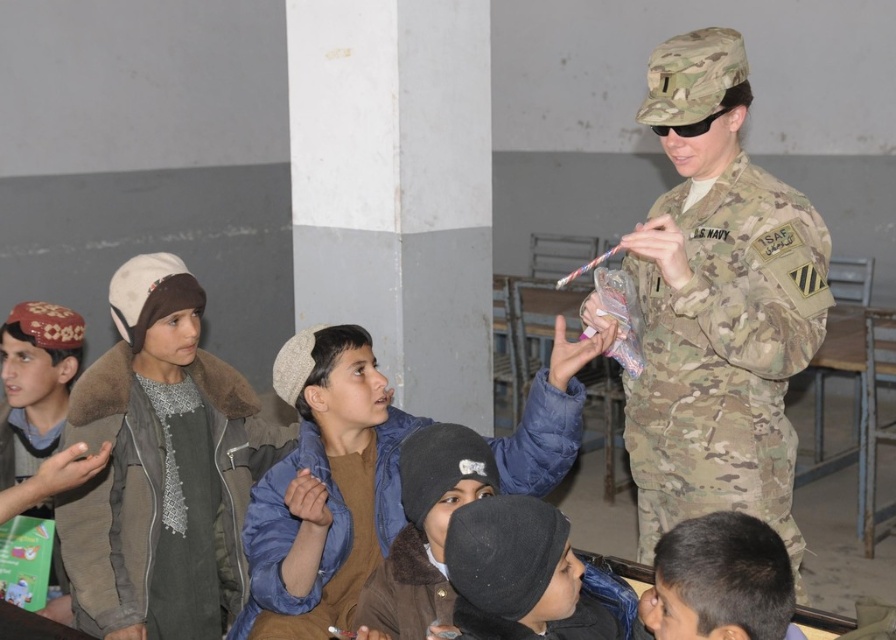
Who is positioned more to the right, camouflage uniform at right or brown fur-lined jacket at left?

From the viewer's perspective, camouflage uniform at right appears more on the right side.

Between camouflage uniform at right and brown fur-lined jacket at left, which one appears on the left side from the viewer's perspective?

From the viewer's perspective, brown fur-lined jacket at left appears more on the left side.

Is point (761, 252) in front of point (179, 538)?

That is True.

Locate an element on the screen. camouflage uniform at right is located at coordinates (718, 305).

Between brown fur-lined jacket at left and black woolen hat at lower center, which one is positioned lower?

black woolen hat at lower center

Between brown fur-lined jacket at left and black woolen hat at lower center, which one appears on the right side from the viewer's perspective?

From the viewer's perspective, black woolen hat at lower center appears more on the right side.

Does point (148, 540) lie in front of point (475, 550)?

That is False.

Locate an element on the screen. brown fur-lined jacket at left is located at coordinates (162, 467).

Is brown fur-lined jacket at left above camouflage fabric uniform at center?

Actually, brown fur-lined jacket at left is below camouflage fabric uniform at center.

Is point (84, 376) positioned after point (329, 493)?

Yes, it is behind point (329, 493).

You are a GUI agent. You are given a task and a screenshot of the screen. Output one action in this format:
    pyautogui.click(x=<x>, y=<y>)
    Task: Click on the brown fur-lined jacket at left
    
    Given the screenshot: What is the action you would take?
    pyautogui.click(x=162, y=467)